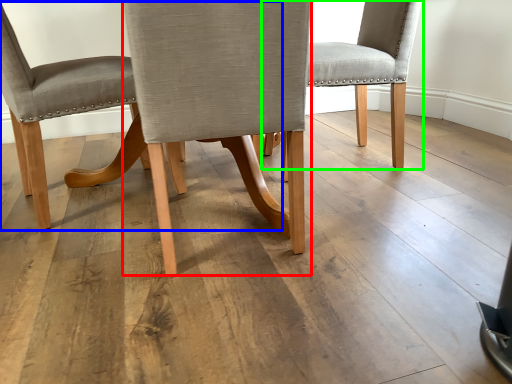
Question: Which object is the closest to the chair (highlighted by a red box)? Choose among these: chair (highlighted by a blue box) or chair (highlighted by a green box).

Choices:
 (A) chair
 (B) chair

Answer: (A)